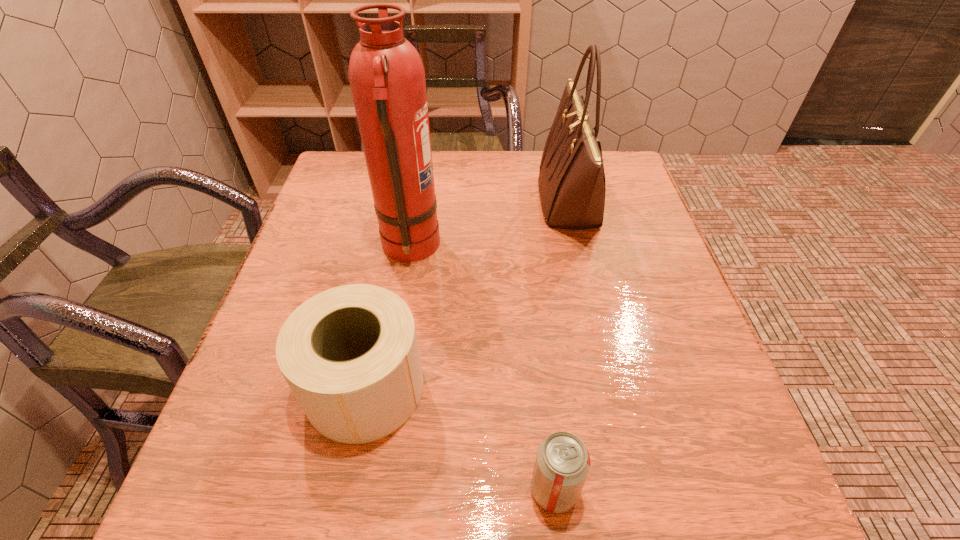
Find the location of a particular element. vacant space at the left edge of the desktop is located at coordinates (326, 224).

You are a GUI agent. You are given a task and a screenshot of the screen. Output one action in this format:
    pyautogui.click(x=<x>, y=<y>)
    Task: Click on the vacant space at the right edge of the desktop
    This screenshot has height=540, width=960.
    Given the screenshot: What is the action you would take?
    pyautogui.click(x=676, y=381)

I want to click on free space at the far left corner of the desktop, so click(x=352, y=196).

Where is `free space at the near left corner of the desktop`? The width and height of the screenshot is (960, 540). free space at the near left corner of the desktop is located at coordinates (223, 470).

Identify the location of empty space between the second tallest object and the third tallest object. (468, 294).

The image size is (960, 540). What are the coordinates of `free point between the handbag and the fire extinguisher` in the screenshot? It's located at (490, 225).

This screenshot has width=960, height=540. What are the coordinates of `vacant point located between the third object from left to right and the tallest object` in the screenshot? It's located at (482, 369).

At what (x,y) coordinates should I click in order to perform the action: click on blank region between the shortest object and the fire extinguisher. Please return your answer as a coordinate pair (x, y). Looking at the image, I should click on (482, 369).

Identify the location of empty space between the tallest object and the rightmost object. This screenshot has width=960, height=540. [490, 225].

Locate an element on the screen. This screenshot has height=540, width=960. vacant area that lies between the handbag and the fire extinguisher is located at coordinates (490, 225).